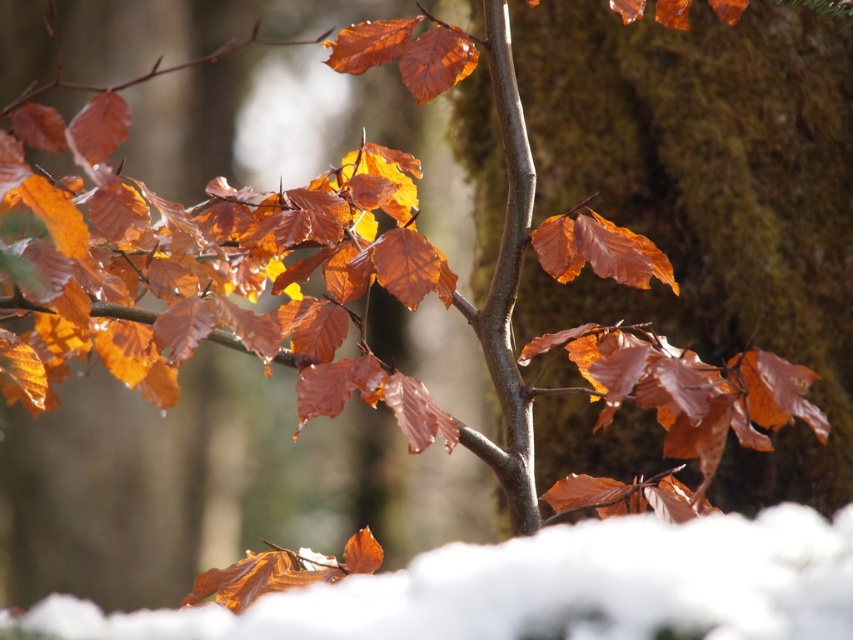
Question: Which object is farther from the camera taking this photo?

Choices:
 (A) smooth bark tree trunk at center
 (B) white fluffy snow at lower center

Answer: (A)

Question: Among these points, which one is nearest to the camera?

Choices:
 (A) (469, 570)
 (B) (486, 324)

Answer: (A)

Question: Among these points, which one is farthest from the camera?

Choices:
 (A) (492, 42)
 (B) (850, 625)

Answer: (A)

Question: Can you confirm if white fluffy snow at lower center is smaller than smooth bark tree trunk at center?

Choices:
 (A) yes
 (B) no

Answer: (B)

Question: Does white fluffy snow at lower center lie in front of smooth bark tree trunk at center?

Choices:
 (A) no
 (B) yes

Answer: (B)

Question: Does white fluffy snow at lower center appear on the right side of smooth bark tree trunk at center?

Choices:
 (A) no
 (B) yes

Answer: (A)